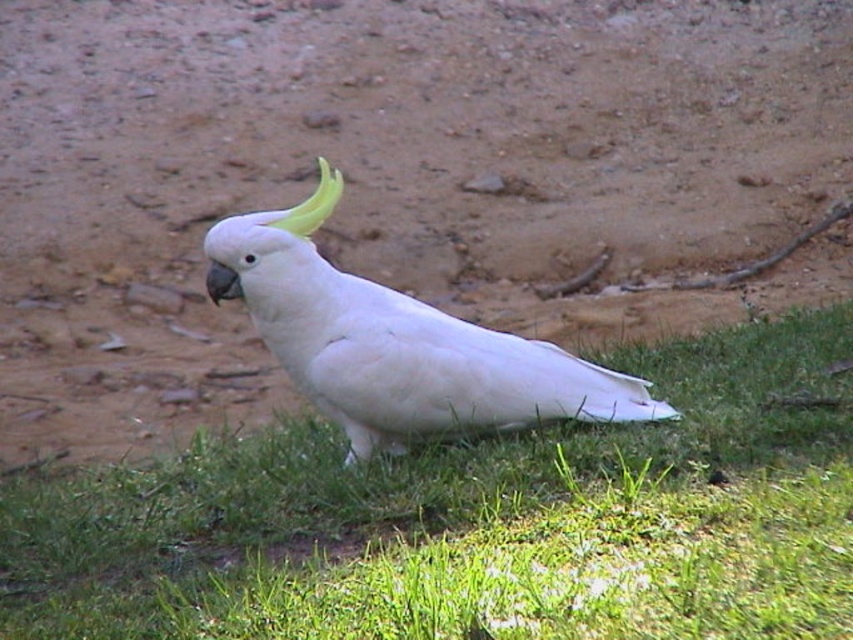
Question: Which of these objects is positioned farthest from the green grass at lower center?

Choices:
 (A) white feathered parrot at center
 (B) brown soil at center

Answer: (B)

Question: Is brown soil at center bigger than green grass at lower center?

Choices:
 (A) yes
 (B) no

Answer: (B)

Question: Can you confirm if brown soil at center is bigger than green grass at lower center?

Choices:
 (A) yes
 (B) no

Answer: (B)

Question: Which point is closer to the camera?

Choices:
 (A) brown soil at center
 (B) white feathered parrot at center
 (C) green grass at lower center

Answer: (C)

Question: Does green grass at lower center have a lesser width compared to white feathered parrot at center?

Choices:
 (A) no
 (B) yes

Answer: (A)

Question: Which of the following is the farthest from the observer?

Choices:
 (A) (421, 387)
 (B) (109, 333)

Answer: (B)